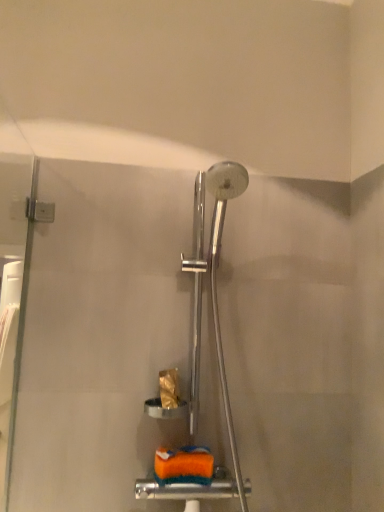
Describe the element at coordinates (184, 466) in the screenshot. The image size is (384, 512). I see `orange sponge at lower center` at that location.

In order to click on orange sponge at lower center in this screenshot , I will do point(184,466).

Measure the distance between point [205,466] and camera.

Point [205,466] is 3.28 feet away from camera.

The height and width of the screenshot is (512, 384). Identify the location of gold textured toilet paper at center. (169, 388).

What do you see at coordinates (169, 388) in the screenshot?
I see `gold textured toilet paper at center` at bounding box center [169, 388].

The height and width of the screenshot is (512, 384). In order to click on orange sponge at lower center in this screenshot , I will do `click(184, 466)`.

Can you confirm if orange sponge at lower center is positioned to the right of gold textured toilet paper at center?

Indeed, orange sponge at lower center is positioned on the right side of gold textured toilet paper at center.

In the scene shown: Is orange sponge at lower center positioned before gold textured toilet paper at center?

That is True.

Based on the photo, which is less distant, (184,452) or (174,371)?

The point (184,452) is closer.

From the image's perspective, would you say orange sponge at lower center is shown under gold textured toilet paper at center?

Yes.

From a real-world perspective, is orange sponge at lower center above or below gold textured toilet paper at center?

In terms of real-world spatial position, orange sponge at lower center is below gold textured toilet paper at center.

Is orange sponge at lower center wider or thinner than gold textured toilet paper at center?

In the image, orange sponge at lower center appears to be wider than gold textured toilet paper at center.

Does orange sponge at lower center have a lesser height compared to gold textured toilet paper at center?

Yes, orange sponge at lower center is shorter than gold textured toilet paper at center.

Can you confirm if orange sponge at lower center is bigger than gold textured toilet paper at center?

Indeed, orange sponge at lower center has a larger size compared to gold textured toilet paper at center.

Is orange sponge at lower center outside of gold textured toilet paper at center?

Indeed, orange sponge at lower center is completely outside gold textured toilet paper at center.

Are orange sponge at lower center and gold textured toilet paper at center located far from each other?

No, orange sponge at lower center is not far from gold textured toilet paper at center.

Could you tell me if orange sponge at lower center is facing gold textured toilet paper at center?

No, orange sponge at lower center is not aimed at gold textured toilet paper at center.

Where is `toilet paper above the orange sponge at lower center (from a real-world perspective)`? Image resolution: width=384 pixels, height=512 pixels. toilet paper above the orange sponge at lower center (from a real-world perspective) is located at coordinates (169, 388).

Looking at this image, which is more to the right, gold textured toilet paper at center or orange sponge at lower center?

Positioned to the right is orange sponge at lower center.

Is gold textured toilet paper at center further to the viewer compared to orange sponge at lower center?

Yes, gold textured toilet paper at center is behind orange sponge at lower center.

Does point (175, 405) lie behind point (192, 466)?

Yes, point (175, 405) is farther from viewer.

From the image's perspective, who appears lower, gold textured toilet paper at center or orange sponge at lower center?

orange sponge at lower center, from the image's perspective.

From a real-world perspective, who is located lower, gold textured toilet paper at center or orange sponge at lower center?

orange sponge at lower center.

Considering the sizes of objects gold textured toilet paper at center and orange sponge at lower center in the image provided, who is wider, gold textured toilet paper at center or orange sponge at lower center?

With larger width is orange sponge at lower center.

Between gold textured toilet paper at center and orange sponge at lower center, which one has more height?

Standing taller between the two is gold textured toilet paper at center.

Considering the sizes of gold textured toilet paper at center and orange sponge at lower center in the image, is gold textured toilet paper at center bigger or smaller than orange sponge at lower center?

In the image, gold textured toilet paper at center appears to be smaller than orange sponge at lower center.

Is orange sponge at lower center a part of gold textured toilet paper at center?

Definitely not — orange sponge at lower center is not inside gold textured toilet paper at center.

Are gold textured toilet paper at center and orange sponge at lower center far apart?

They are positioned close to each other.

Is gold textured toilet paper at center turned away from orange sponge at lower center?

That's not correct — gold textured toilet paper at center is not looking away from orange sponge at lower center.

What's the angular difference between gold textured toilet paper at center and orange sponge at lower center's facing directions?

gold textured toilet paper at center and orange sponge at lower center are facing 0.00121 degrees away from each other.

Where is `toilet paper that appears behind the orange sponge at lower center`? toilet paper that appears behind the orange sponge at lower center is located at coordinates pyautogui.click(x=169, y=388).

You are a GUI agent. You are given a task and a screenshot of the screen. Output one action in this format:
    pyautogui.click(x=<x>, y=<y>)
    Task: Click on the material below the gold textured toilet paper at center (from the image's perspective)
    The image size is (384, 512).
    Given the screenshot: What is the action you would take?
    pyautogui.click(x=184, y=466)

The height and width of the screenshot is (512, 384). Identify the location of material that is in front of the gold textured toilet paper at center. (184, 466).